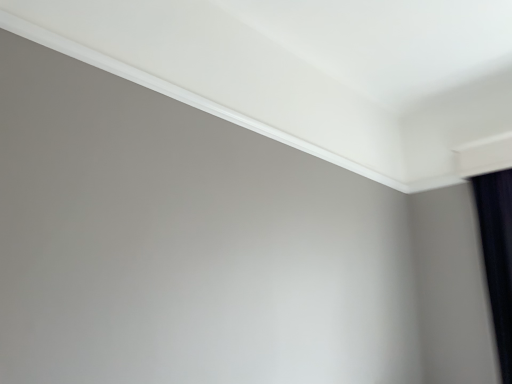
The width and height of the screenshot is (512, 384). Identify the location of dark velvet curtain at right. (497, 256).

Image resolution: width=512 pixels, height=384 pixels. What do you see at coordinates (497, 256) in the screenshot?
I see `dark velvet curtain at right` at bounding box center [497, 256].

This screenshot has width=512, height=384. Identify the location of dark velvet curtain at right. (497, 256).